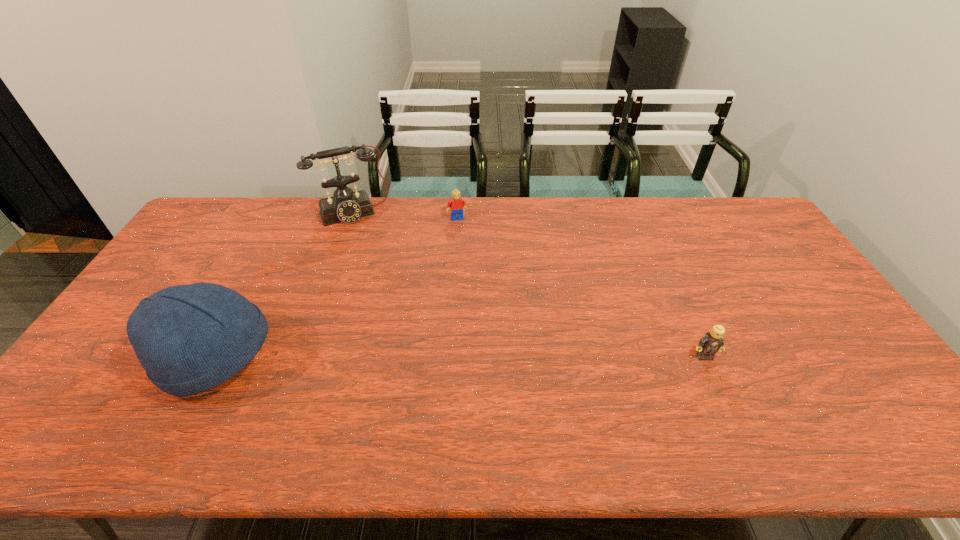
What are the coordinates of `free spot on the desktop that is between the skullcap and the nearer Lego and is positioned on the face of the second object from right to left` in the screenshot? It's located at (502, 357).

At what (x,y) coordinates should I click in order to perform the action: click on vacant space on the desktop that is between the third shortest object and the nearer Lego and is positioned on the dial of the telephone. Please return your answer as a coordinate pair (x, y). Looking at the image, I should click on (410, 357).